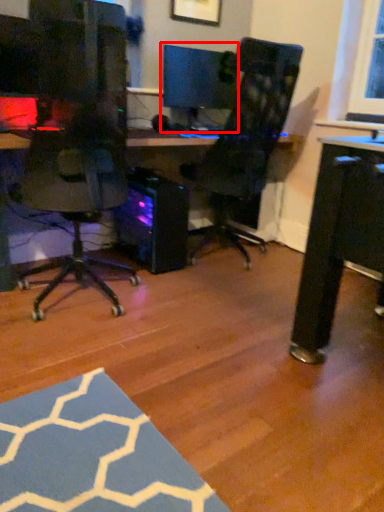
Question: From the image's perspective, where is computer monitor (annotated by the red box) located relative to computer tower?

Choices:
 (A) above
 (B) below

Answer: (A)